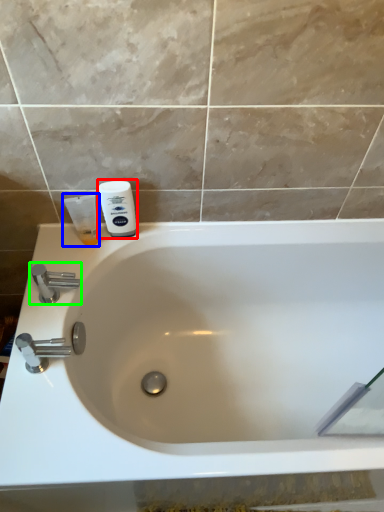
Question: Estimate the real-world distances between objects in this image. Which object is closer to shaving cream (highlighted by a red box), shaving cream (highlighted by a blue box) or tap (highlighted by a green box)?

Choices:
 (A) shaving cream
 (B) tap

Answer: (A)